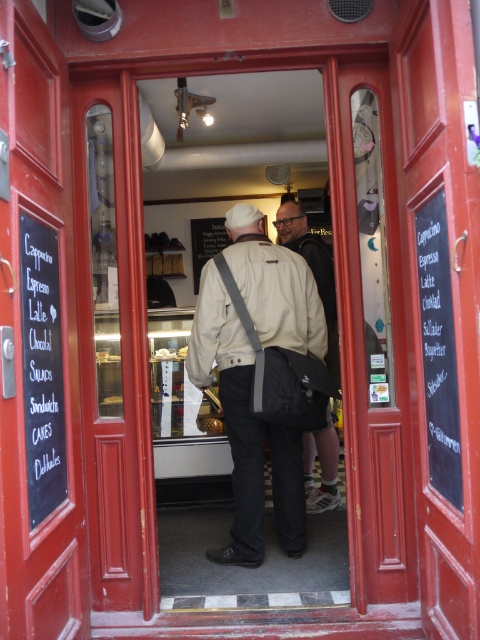
Is black chalkboard at center taller than black chalkboard at left?

Yes.

Who is lower down, black chalkboard at center or black chalkboard at left?

black chalkboard at left is lower down.

Find the location of a particular element. black chalkboard at center is located at coordinates (37, 342).

Identify the location of black chalkboard at center. (37, 342).

Who is more distant from viewer, (231, 451) or (324, 282)?

Point (324, 282)

What do you see at coordinates (245, 429) in the screenshot?
I see `beige fabric jacket at center` at bounding box center [245, 429].

The width and height of the screenshot is (480, 640). In order to click on beige fabric jacket at center in this screenshot , I will do `click(245, 429)`.

Between smooth glass door at center and smooth wooden door at center, which one appears on the right side from the viewer's perspective?

smooth wooden door at center

Which is above, smooth glass door at center or smooth wooden door at center?

smooth wooden door at center

Locate an element on the screen. The image size is (480, 640). smooth glass door at center is located at coordinates (113, 346).

This screenshot has width=480, height=640. Find the location of `smooth glass door at center`. smooth glass door at center is located at coordinates (113, 346).